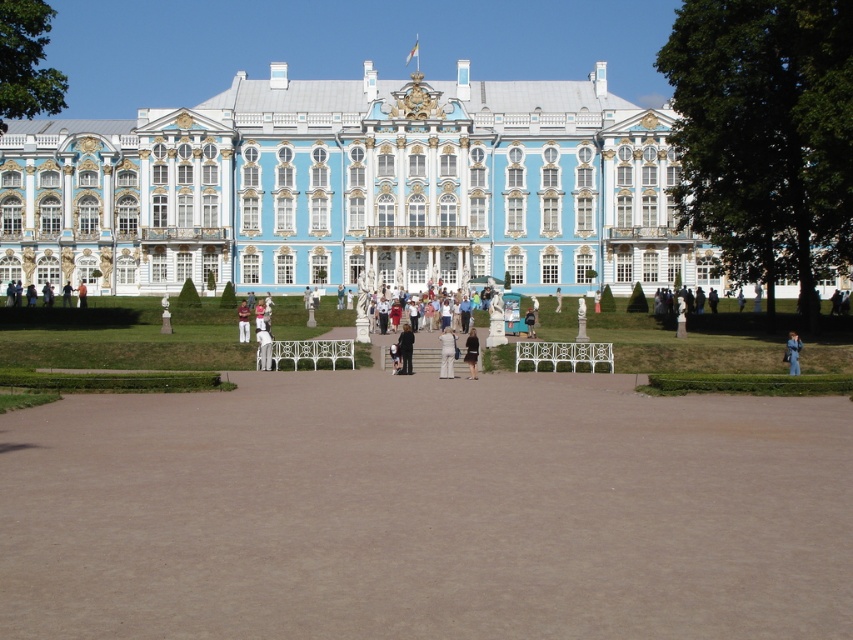
Question: Can you confirm if white fabric pants at center is positioned to the right of light brown wooden bench at center?

Choices:
 (A) no
 (B) yes

Answer: (B)

Question: Estimate the real-world distances between objects in this image. Which object is closer to the blue painted stone palace at center?

Choices:
 (A) dark gray suit at center
 (B) blue fabric coat at center

Answer: (A)

Question: Is white cotton shirt at center to the right of light brown wooden bench at center from the viewer's perspective?

Choices:
 (A) no
 (B) yes

Answer: (B)

Question: Does white fabric pants at center appear over white cotton shirt at center?

Choices:
 (A) yes
 (B) no

Answer: (B)

Question: Among these objects, which one is nearest to the camera?

Choices:
 (A) light brown wooden bench at center
 (B) dark gray suit at center
 (C) dark brown leather jacket at center
 (D) blue painted stone palace at center

Answer: (C)

Question: Which is farther from the white cotton shirt at center?

Choices:
 (A) brown gravel at center
 (B) white fabric pants at center
 (C) dark gray suit at center

Answer: (A)